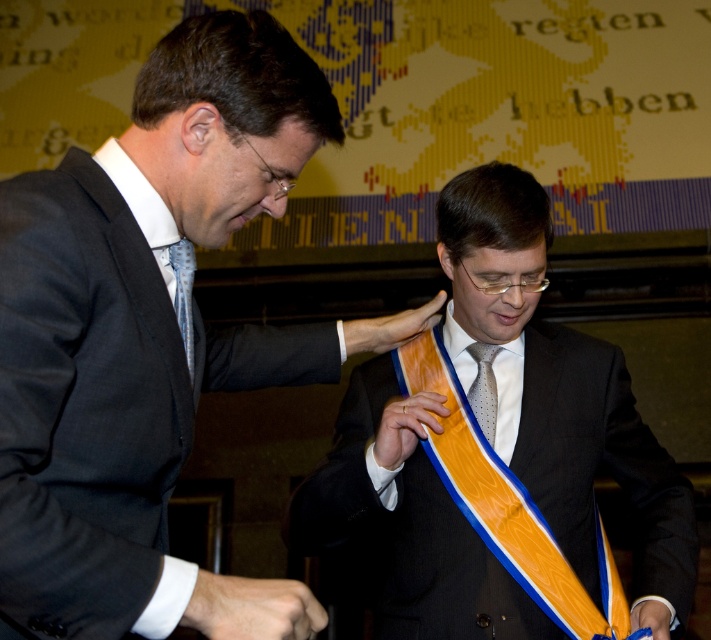
Is matte black suit at center bigger than orange satin sash at center?

Incorrect, matte black suit at center is not larger than orange satin sash at center.

You are a GUI agent. You are given a task and a screenshot of the screen. Output one action in this format:
    pyautogui.click(x=<x>, y=<y>)
    Task: Click on the matte black suit at center
    Image resolution: width=711 pixels, height=640 pixels.
    Given the screenshot: What is the action you would take?
    pyautogui.click(x=149, y=337)

Between matte black suit at center and blue dotted tie at left, which one is positioned higher?

matte black suit at center is higher up.

Which is below, matte black suit at center or blue dotted tie at left?

blue dotted tie at left is lower down.

Is point (187, 115) less distant than point (192, 353)?

That is True.

At what (x,y) coordinates should I click in order to perform the action: click on matte black suit at center. Please return your answer as a coordinate pair (x, y). Looking at the image, I should click on (149, 337).

Between orange satin sash at center and blue dotted tie at left, which one appears on the left side from the viewer's perspective?

blue dotted tie at left

This screenshot has width=711, height=640. In order to click on orange satin sash at center in this screenshot , I will do `click(560, 392)`.

You are a GUI agent. You are given a task and a screenshot of the screen. Output one action in this format:
    pyautogui.click(x=<x>, y=<y>)
    Task: Click on the orange satin sash at center
    
    Given the screenshot: What is the action you would take?
    pyautogui.click(x=560, y=392)